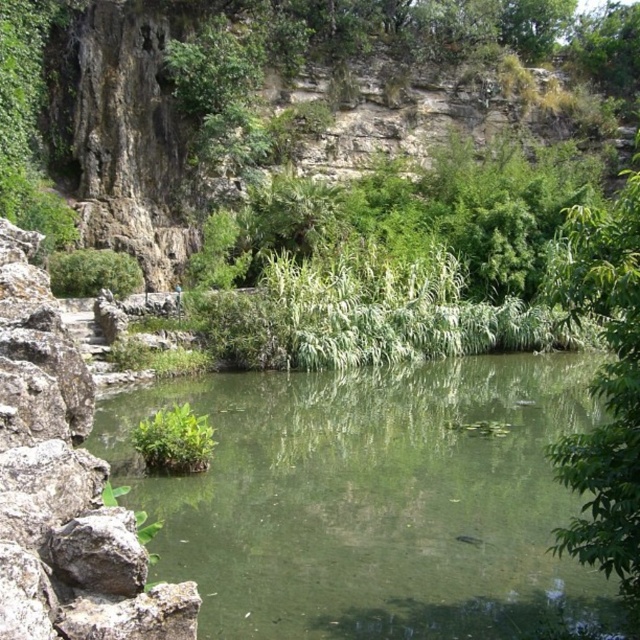
Based on the photo, you are standing on the shore looking at the scene. Which object is closer to your right side, the green translucent water at center or the gray rough rock at left?

The green translucent water at center is closer to your right side because it is positioned to the right of the gray rough rock at left.

You are standing at the edge of the water in the serene natural scene. You notice two points marked in the image. Which point, point (260, 460) or point (600, 554), is closer to you?

Point (260, 460) is closer to you because it is further to the viewer than point (600, 554).